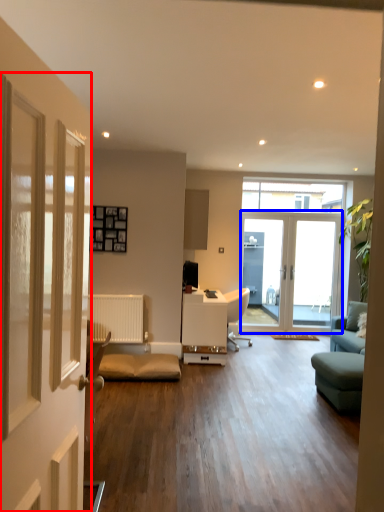
Question: Which point is closer to the camera, door (highlighted by a red box) or door (highlighted by a blue box)?

Choices:
 (A) door
 (B) door

Answer: (A)